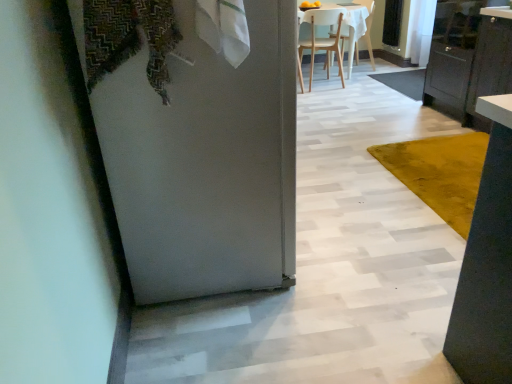
Question: Is clear glass screen door at upper right thinner than patterned fabric laundry at upper left?

Choices:
 (A) yes
 (B) no

Answer: (A)

Question: Is clear glass screen door at upper right taller than patterned fabric laundry at upper left?

Choices:
 (A) yes
 (B) no

Answer: (A)

Question: Is clear glass screen door at upper right completely or partially outside of patterned fabric laundry at upper left?

Choices:
 (A) no
 (B) yes

Answer: (B)

Question: Does clear glass screen door at upper right come behind patterned fabric laundry at upper left?

Choices:
 (A) no
 (B) yes

Answer: (B)

Question: Considering the relative positions of clear glass screen door at upper right and patterned fabric laundry at upper left in the image provided, is clear glass screen door at upper right to the left of patterned fabric laundry at upper left from the viewer's perspective?

Choices:
 (A) yes
 (B) no

Answer: (B)

Question: From the image's perspective, is patterned fabric laundry at upper left positioned above or below white matte door at left?

Choices:
 (A) above
 (B) below

Answer: (A)

Question: Is patterned fabric laundry at upper left bigger or smaller than white matte door at left?

Choices:
 (A) small
 (B) big

Answer: (A)

Question: Does point (109, 52) appear closer or farther from the camera than point (161, 226)?

Choices:
 (A) closer
 (B) farther

Answer: (A)

Question: From a real-world perspective, relative to white matte door at left, is patterned fabric laundry at upper left vertically above or below?

Choices:
 (A) above
 (B) below

Answer: (A)

Question: From a real-world perspective, is white matte door at left physically located above or below white matte chair at upper center, the first chair in the left-to-right sequence?

Choices:
 (A) above
 (B) below

Answer: (A)

Question: Is white matte door at left situated inside white matte chair at upper center, the 2th chair when ordered from right to left, or outside?

Choices:
 (A) outside
 (B) inside

Answer: (A)

Question: Based on their positions, is white matte door at left located to the left or right of white matte chair at upper center, the 2th chair when ordered from right to left?

Choices:
 (A) right
 (B) left

Answer: (B)

Question: Is white matte door at left in front of or behind white matte chair at upper center, the 2th chair when ordered from right to left, in the image?

Choices:
 (A) behind
 (B) front

Answer: (B)

Question: Based on their sizes in the image, would you say yellow velvet rug at center is bigger or smaller than clear glass screen door at upper right?

Choices:
 (A) small
 (B) big

Answer: (B)

Question: From the image's perspective, is yellow velvet rug at center above or below clear glass screen door at upper right?

Choices:
 (A) above
 (B) below

Answer: (B)